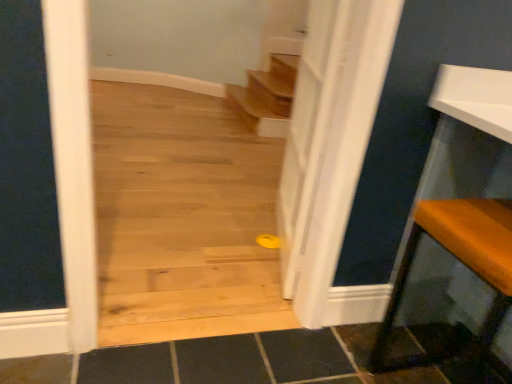
In order to click on vacant space situated on the left part of white glossy door at center in this screenshot , I will do `click(224, 245)`.